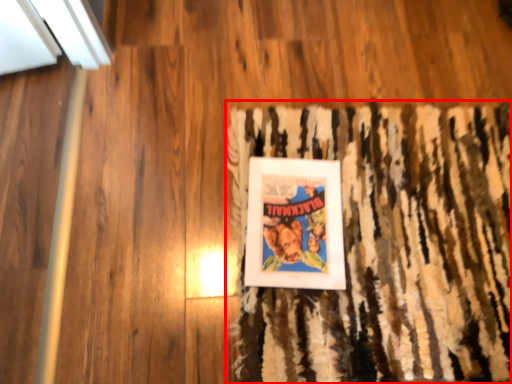
Question: Considering the relative positions of doormat (annotated by the red box) and picture frame in the image provided, where is doormat (annotated by the red box) located with respect to the staircase?

Choices:
 (A) right
 (B) left

Answer: (A)